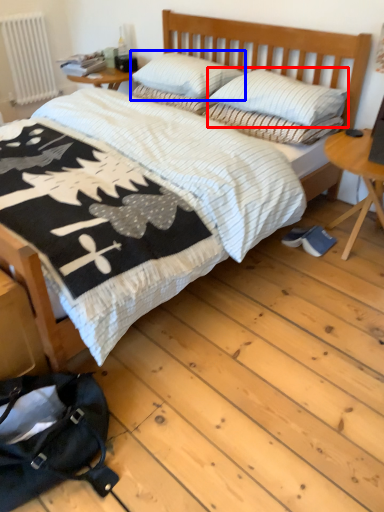
Question: Which object appears closest to the camera in this image, pillow (highlighted by a red box) or pillow (highlighted by a blue box)?

Choices:
 (A) pillow
 (B) pillow

Answer: (A)